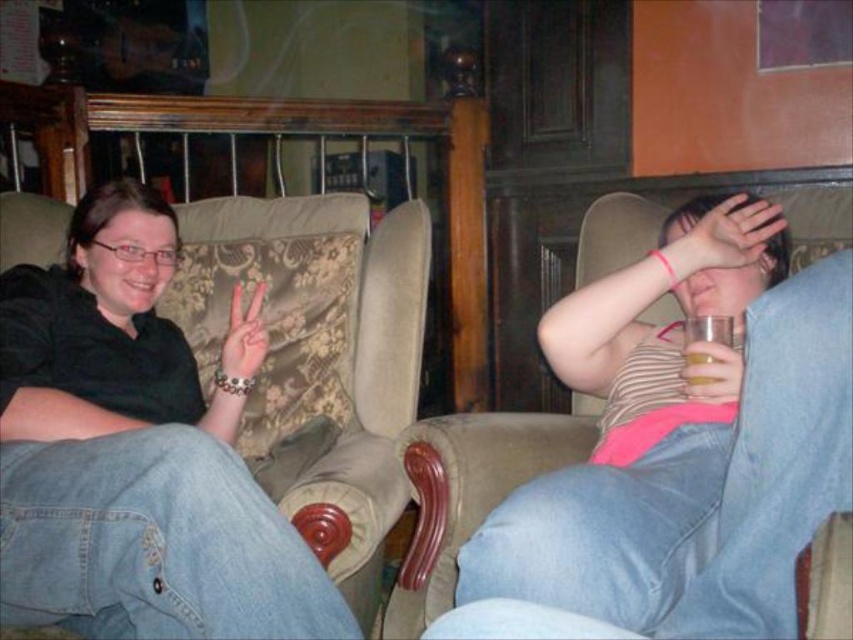
You are a photographer trying to capture a closeup shot of both the matte pink tank top at center and the translucent glass at right. Given the camera you are using has a minimum focus distance of 8 inches, will you be able to focus on both subjects simultaneously?

The matte pink tank top at center and the translucent glass at right are 9.10 inches apart from each other. Since the distance between them is greater than the camera minimum focus distance of 8 inches, you can focus on both subjects simultaneously.

You are standing in the living room and want to place a small plant on the table. The table is located at point (689, 444). Which object is at that point?

The matte pink tank top at center is located at point (689, 444).